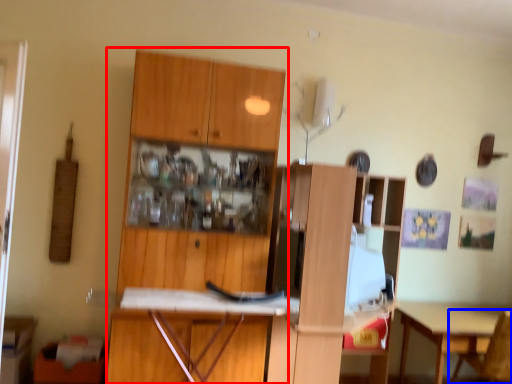
Question: Which point is further to the camera, cabinetry (highlighted by a red box) or chair (highlighted by a blue box)?

Choices:
 (A) cabinetry
 (B) chair

Answer: (B)